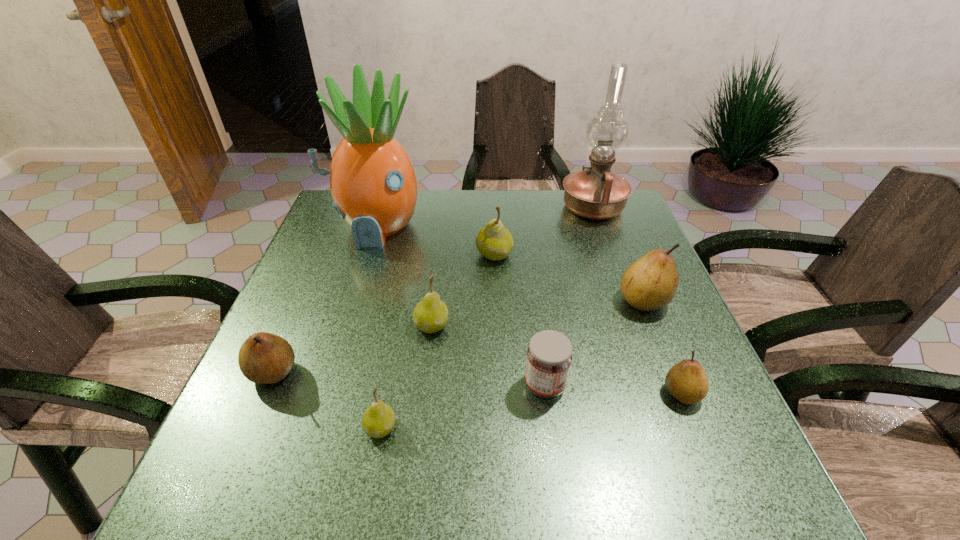
Locate an element on the screen. free location located on the left of the smallest brown pear is located at coordinates (636, 393).

Locate an element on the screen. free region located 0.230m on the back of the smallest green pear is located at coordinates (400, 322).

You are a GUI agent. You are given a task and a screenshot of the screen. Output one action in this format:
    pyautogui.click(x=<x>, y=<y>)
    Task: Click on the oil lamp at the far edge
    This screenshot has width=960, height=540.
    Given the screenshot: What is the action you would take?
    pyautogui.click(x=596, y=193)

Identify the location of pineapple that is at the far edge. The image size is (960, 540). (372, 180).

This screenshot has height=540, width=960. I want to click on pineapple located at the left edge, so click(x=372, y=180).

You are a GUI agent. You are given a task and a screenshot of the screen. Output one action in this format:
    pyautogui.click(x=<x>, y=<y>)
    Task: Click on the pear at the left edge
    The image size is (960, 540).
    Given the screenshot: What is the action you would take?
    pyautogui.click(x=264, y=358)

The height and width of the screenshot is (540, 960). What are the coordinates of `oil lamp that is positioned at the right edge` in the screenshot? It's located at (596, 193).

Find the location of a particular element. object located in the far left corner section of the desktop is located at coordinates click(372, 180).

You are a GUI agent. You are given a task and a screenshot of the screen. Output one action in this format:
    pyautogui.click(x=<x>, y=<y>)
    Task: Click on the object at the far right corner
    The width and height of the screenshot is (960, 540).
    Given the screenshot: What is the action you would take?
    pyautogui.click(x=596, y=193)

I want to click on vacant space at the far edge of the desktop, so click(464, 203).